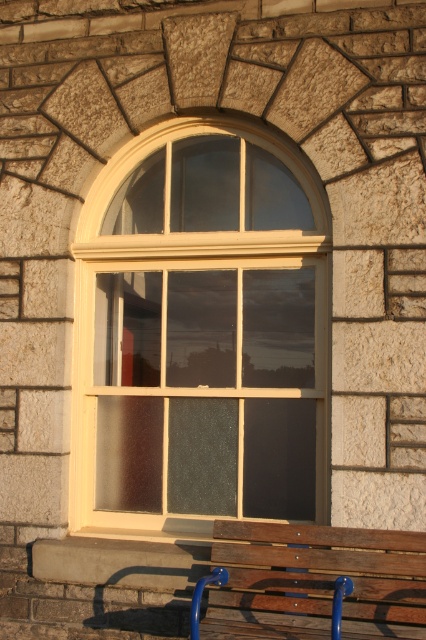
Looking at this image, which of these two, matte cream window at center or wooden bench at lower center, stands taller?

With more height is matte cream window at center.

Which is above, matte cream window at center or wooden bench at lower center?

matte cream window at center is higher up.

I want to click on matte cream window at center, so click(x=199, y=333).

Find the location of `matte cream window at center`. matte cream window at center is located at coordinates (199, 333).